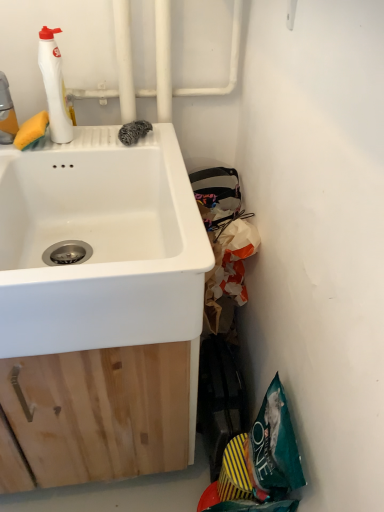
Question: In the image, is teal fabric bag at lower right positioned in front of or behind white matte bottle at upper left, which is the first cleaning product in right-to-left order?

Choices:
 (A) front
 (B) behind

Answer: (A)

Question: Considering the positions of teal fabric bag at lower right and white matte bottle at upper left, which is the first cleaning product in right-to-left order, in the image, is teal fabric bag at lower right taller or shorter than white matte bottle at upper left, which is the first cleaning product in right-to-left order,?

Choices:
 (A) short
 (B) tall

Answer: (B)

Question: Which object is the closest to the white ceramic sink at upper left?

Choices:
 (A) translucent white bottle at upper left, which ranks as the 2th cleaning product in right-to-left order
 (B) teal fabric bag at lower right
 (C) white matte bottle at upper left, which is the first cleaning product in right-to-left order

Answer: (C)

Question: Based on their relative distances, which object is nearer to the teal fabric bag at lower right?

Choices:
 (A) white ceramic sink at upper left
 (B) translucent white bottle at upper left, which ranks as the 2th cleaning product in right-to-left order
 (C) white matte bottle at upper left, which is the first cleaning product in right-to-left order

Answer: (A)